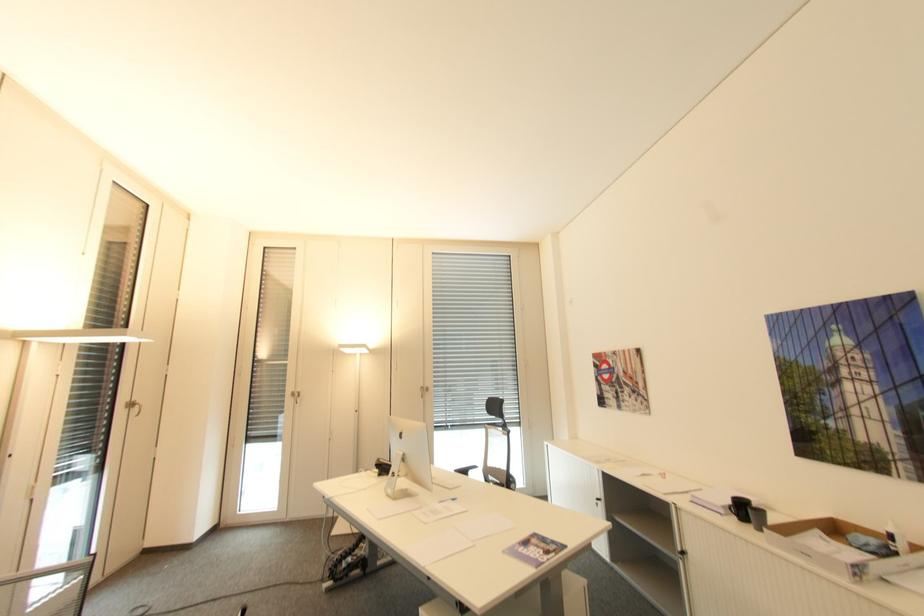
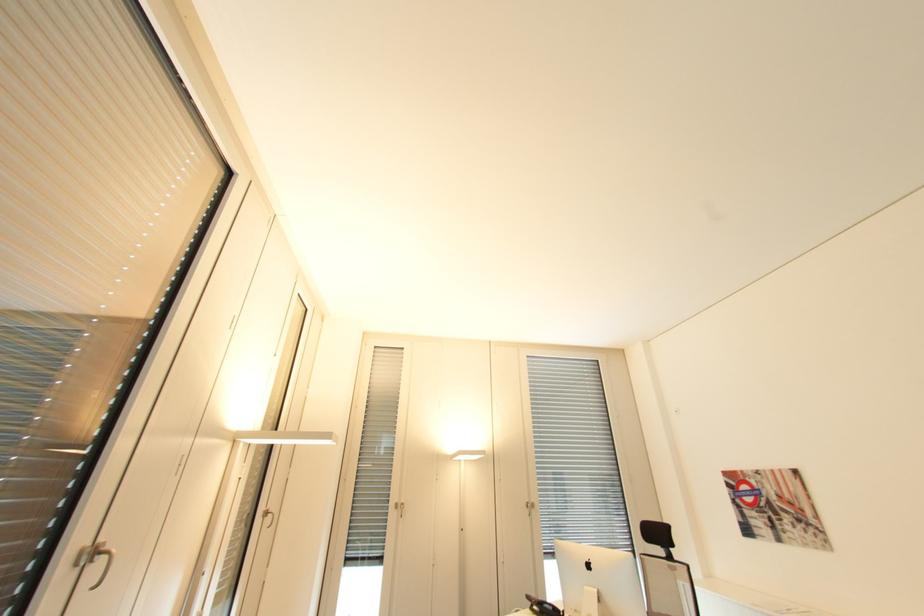
The point at (131, 402) is marked in the first image. Where is the corresponding point in the second image?

(270, 511)